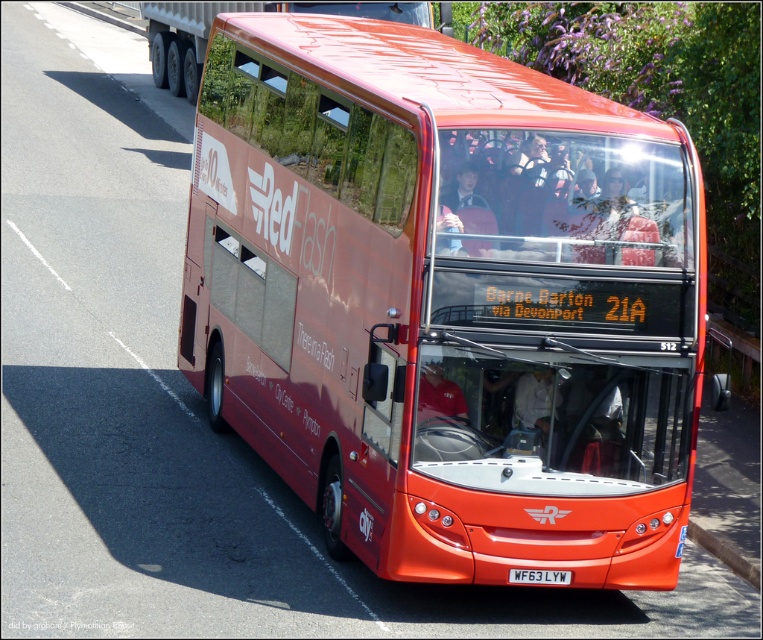
Question: Which object is farther from the camera taking this photo?

Choices:
 (A) shiny red bus at center
 (B) white plastic license plate at center

Answer: (B)

Question: Considering the real-world distances, which object is closest to the shiny red bus at center?

Choices:
 (A) white plastic license plate at center
 (B) concrete at lower right

Answer: (A)

Question: Which point is closer to the camera?

Choices:
 (A) click(554, 294)
 (B) click(536, 572)
 (C) click(700, 536)

Answer: (A)

Question: Is shiny red bus at center smaller than concrete at lower right?

Choices:
 (A) no
 (B) yes

Answer: (B)

Question: Does shiny red bus at center lie in front of white plastic license plate at center?

Choices:
 (A) no
 (B) yes

Answer: (B)

Question: Does shiny red bus at center have a larger size compared to concrete at lower right?

Choices:
 (A) no
 (B) yes

Answer: (A)